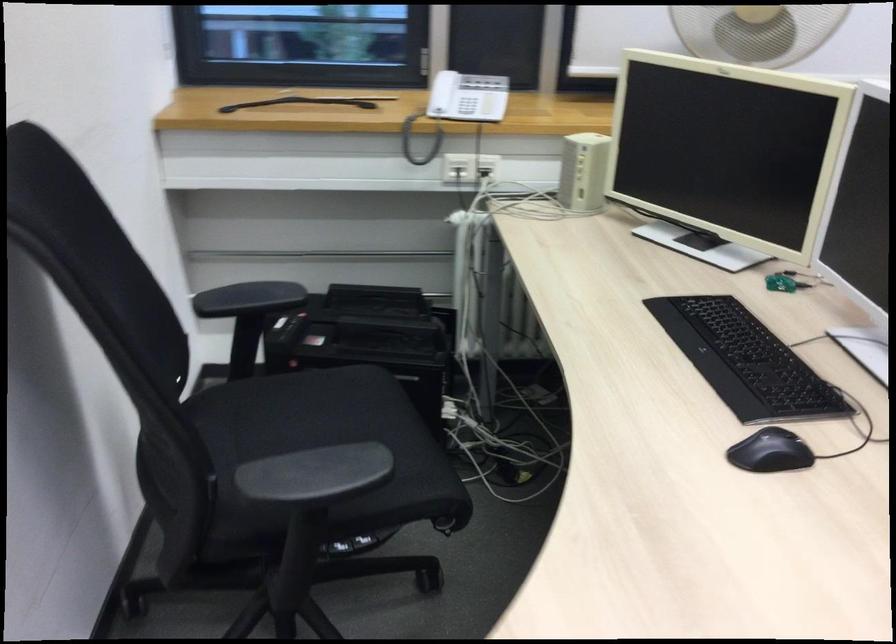
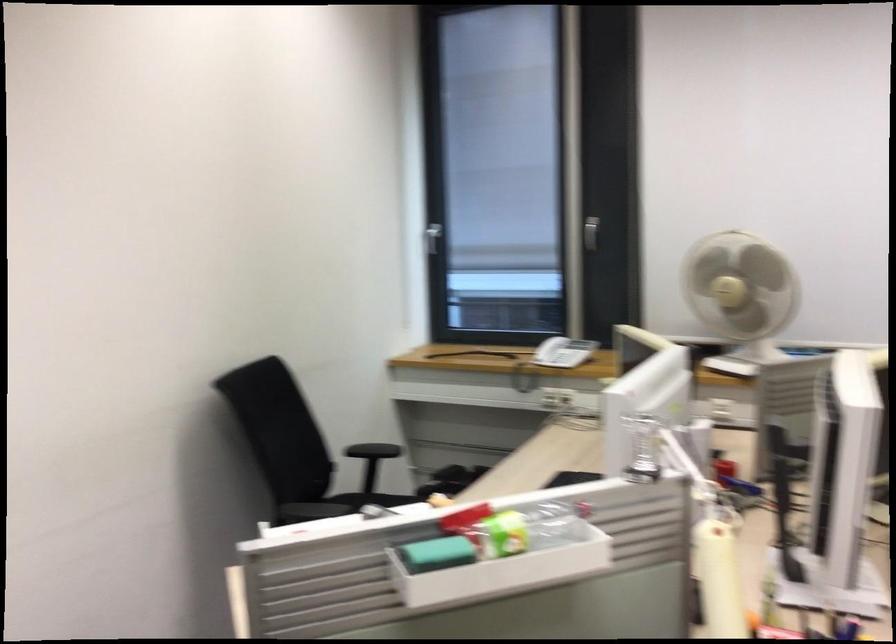
The point at (x=484, y=108) is marked in the first image. Where is the corresponding point in the second image?

(563, 352)